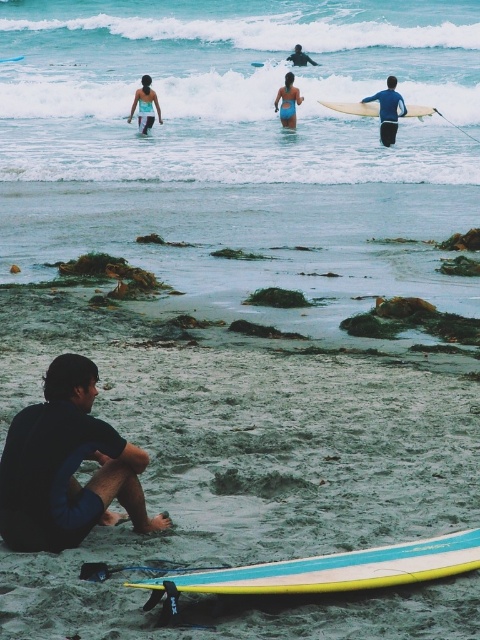
Between point (443, 561) and point (396, 125), which one is positioned in front?

Point (443, 561) is in front.

Is blue/yellow striped surfboard at lower center behind blue matte surfboard at upper center?

That is False.

Locate an element on the screen. blue/yellow striped surfboard at lower center is located at coordinates [x=334, y=570].

Between clear blue water at upper center and blue glossy surfboard at lower center, which one appears on the right side from the viewer's perspective?

Positioned to the right is clear blue water at upper center.

Between clear blue water at upper center and blue glossy surfboard at lower center, which one has more height?

clear blue water at upper center

Is point (225, 307) positioned in front of point (7, 60)?

Yes, it is in front of point (7, 60).

The height and width of the screenshot is (640, 480). I want to click on clear blue water at upper center, so click(x=240, y=147).

Does dark blue wetsuit at lower left appear under blue glossy surfboard at lower center?

Yes, dark blue wetsuit at lower left is below blue glossy surfboard at lower center.

You are a GUI agent. You are given a task and a screenshot of the screen. Output one action in this format:
    pyautogui.click(x=<x>, y=<y>)
    Task: Click on the dark blue wetsuit at lower left
    
    Given the screenshot: What is the action you would take?
    pyautogui.click(x=67, y=467)

Is point (19, 422) farther from camera compared to point (0, 60)?

That is False.

Where is `dark blue wetsuit at lower left`? This screenshot has height=640, width=480. dark blue wetsuit at lower left is located at coordinates (67, 467).